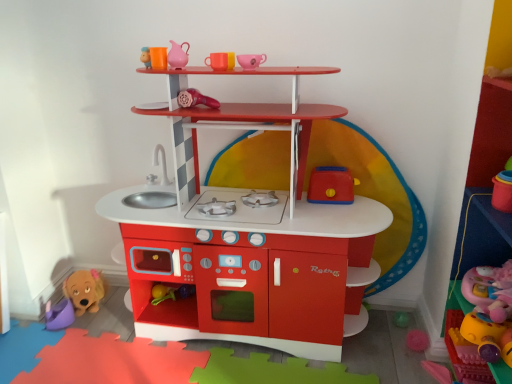
I want to click on vacant area situated to the left side of purple plastic bucket at lower left, acting as the 8th toy starting from the right, so click(23, 327).